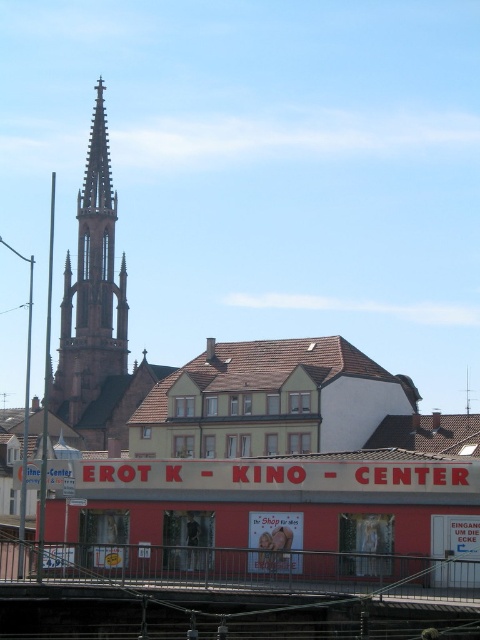
Question: Is metallic gray train track at lower center below white glossy poster at center?

Choices:
 (A) no
 (B) yes

Answer: (B)

Question: Observing the image, what is the correct spatial positioning of metallic gray train track at lower center in reference to white glossy poster at center?

Choices:
 (A) right
 (B) left

Answer: (B)

Question: Estimate the real-world distances between objects in this image. Which object is farther from the white glossy poster at center?

Choices:
 (A) brown stone spire at left
 (B) metallic gray train track at lower center

Answer: (A)

Question: Estimate the real-world distances between objects in this image. Which object is farther from the white glossy poster at center?

Choices:
 (A) brown stone spire at left
 (B) metallic gray train track at lower center

Answer: (A)

Question: Which point appears farthest from the camera in this image?

Choices:
 (A) (96, 115)
 (B) (287, 541)

Answer: (A)

Question: From the image, what is the correct spatial relationship of metallic gray train track at lower center in relation to white glossy poster at center?

Choices:
 (A) left
 (B) right

Answer: (A)